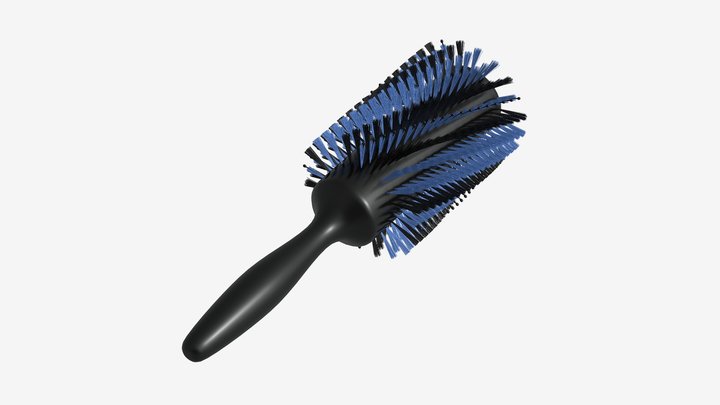
I want to click on handle on brush, so click(x=248, y=297).